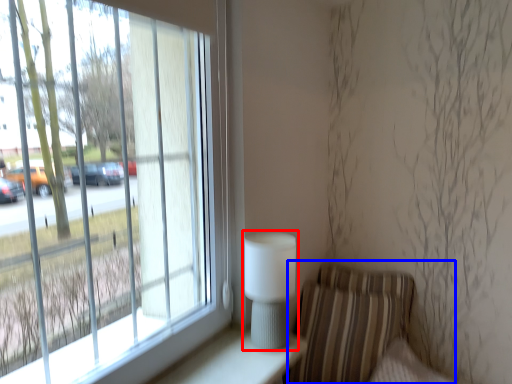
Question: Which object appears farthest to the camera in this image, table lamp (highlighted by a red box) or armchair (highlighted by a blue box)?

Choices:
 (A) table lamp
 (B) armchair

Answer: (B)